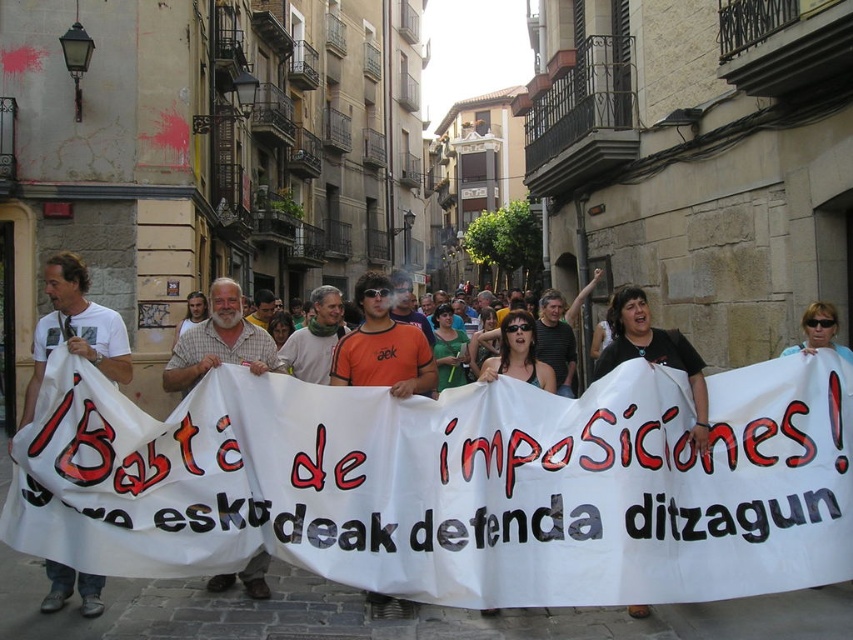
Question: Which point is closer to the camera?

Choices:
 (A) (682, 360)
 (B) (73, 298)

Answer: (B)

Question: Which object appears closest to the camera in this image?

Choices:
 (A) plaid cotton shirt at center
 (B) black matte shirt at center
 (C) white t-shirt at center

Answer: (B)

Question: Is white t-shirt at center to the left of plaid cotton shirt at center from the viewer's perspective?

Choices:
 (A) no
 (B) yes

Answer: (B)

Question: Among these objects, which one is farthest from the camera?

Choices:
 (A) black matte shirt at center
 (B) plaid cotton shirt at center

Answer: (B)

Question: Is plaid cotton shirt at center in front of black matte shirt at center?

Choices:
 (A) no
 (B) yes

Answer: (A)

Question: Does plaid cotton shirt at center appear on the right side of black matte shirt at center?

Choices:
 (A) yes
 (B) no

Answer: (B)